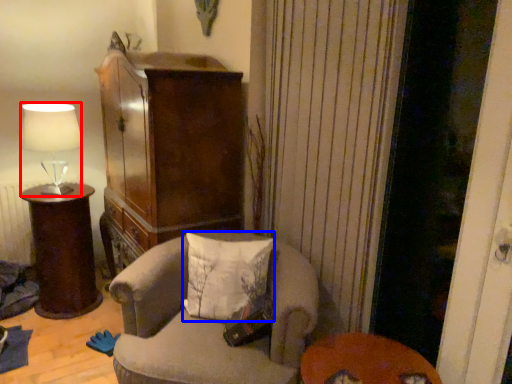
Question: Which of the following is the closest to the observer, lamp (highlighted by a red box) or pillow (highlighted by a blue box)?

Choices:
 (A) lamp
 (B) pillow

Answer: (B)